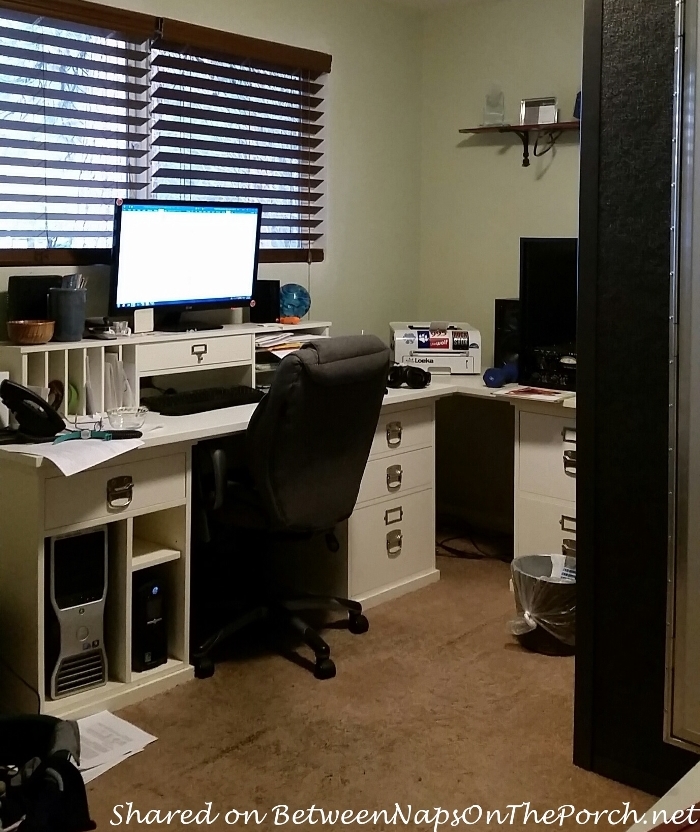
Identify the location of computer monitor. (228, 255).